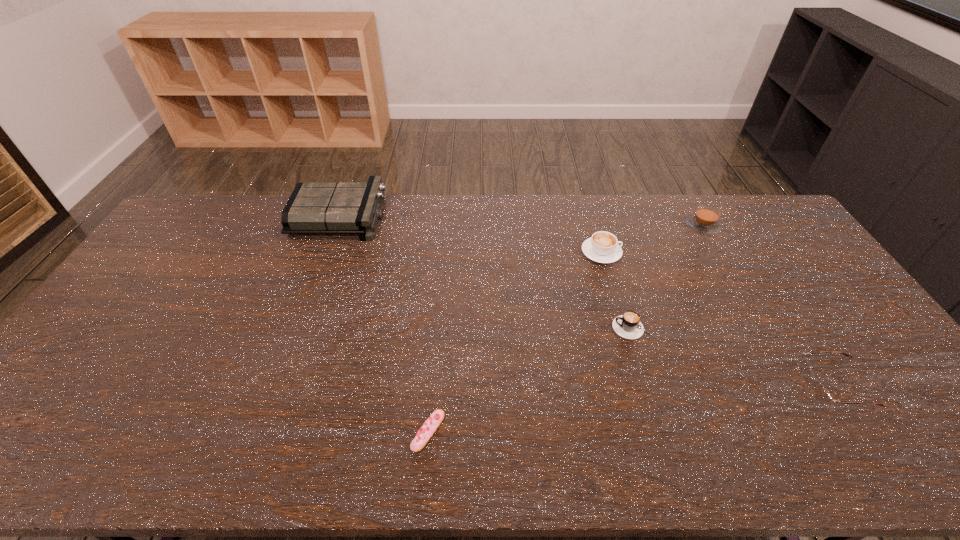
The width and height of the screenshot is (960, 540). What are the coordinates of `object that is at the near edge` in the screenshot? It's located at (x=430, y=426).

Locate an element on the screen. Image resolution: width=960 pixels, height=540 pixels. object present at the right edge is located at coordinates (819, 392).

At what (x,y) coordinates should I click in order to perform the action: click on vacant space at the far edge. Please return your answer as a coordinate pair (x, y). Looking at the image, I should click on (459, 225).

The width and height of the screenshot is (960, 540). In order to click on vacant area at the near edge of the desktop in this screenshot , I will do `click(134, 449)`.

This screenshot has height=540, width=960. In order to click on free space at the left edge in this screenshot , I will do `click(129, 323)`.

Identify the location of vacant region at the right edge. The height and width of the screenshot is (540, 960). (863, 328).

Where is `empty space that is in between the spectacles and the rightmost cappuccino`? This screenshot has height=540, width=960. empty space that is in between the spectacles and the rightmost cappuccino is located at coordinates (768, 306).

You are a GUI agent. You are given a task and a screenshot of the screen. Output one action in this format:
    pyautogui.click(x=<x>, y=<y>)
    Task: Click on the free spot between the farthest cappuccino and the nearest cappuccino
    This screenshot has width=960, height=540.
    Given the screenshot: What is the action you would take?
    pyautogui.click(x=668, y=277)

Identify the location of vacant area that lies between the second farthest cappuccino and the nearest cappuccino. (617, 290).

The width and height of the screenshot is (960, 540). What are the coordinates of `vacant space that is in between the nearest cappuccino and the spectacles` in the screenshot? It's located at (733, 357).